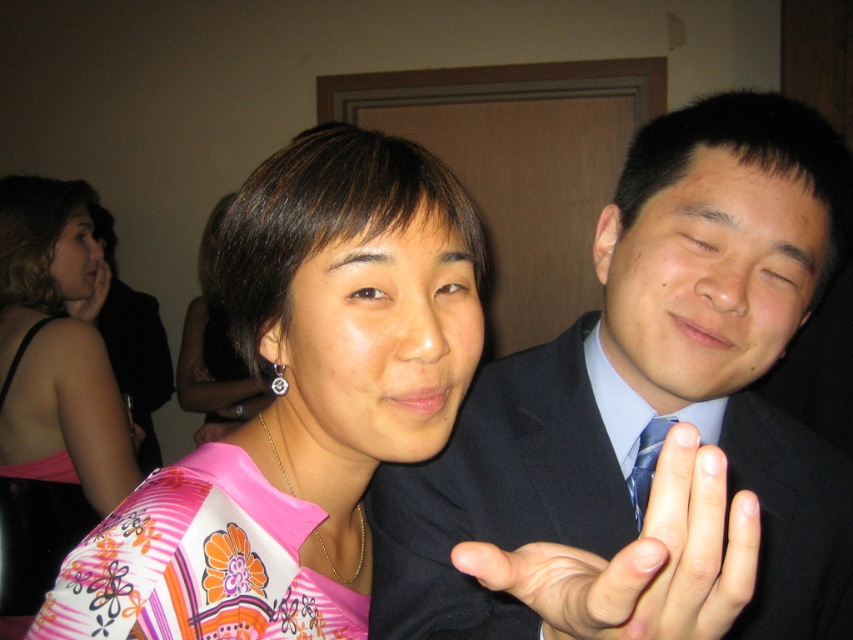
You are a photographer at a social event and need to adjust the camera focus. The subjects are wearing a pink floral dress at center and a blue silk tie at center. Which one is closer to the camera?

The pink floral dress at center is 1.29 meters away from the blue silk tie at center, so the blue silk tie at center is closer to the camera.

You are organizing a photo shoot and need to ensure the matte black suit at right and the pink floral dress at center fit within a 1.2 meter wide backdrop. Based on their widths, will both items fit side by side?

The matte black suit at right has a lesser width compared to pink floral dress at center. If the combined width of both items is less than or equal to 1.2 meters, they can fit. However, without knowing the exact widths, it is impossible to determine definitively.

You are a photographer trying to adjust the lighting for a photo of the two people in the scene. You need to place a spotlight at point (642, 560) to highlight the smooth skin hands at center. Where exactly should you position the spotlight relative to the two people?

The smooth skin hands at center is located at point (642, 560), so you should position the spotlight at that coordinate to highlight the smooth skin hands at center.